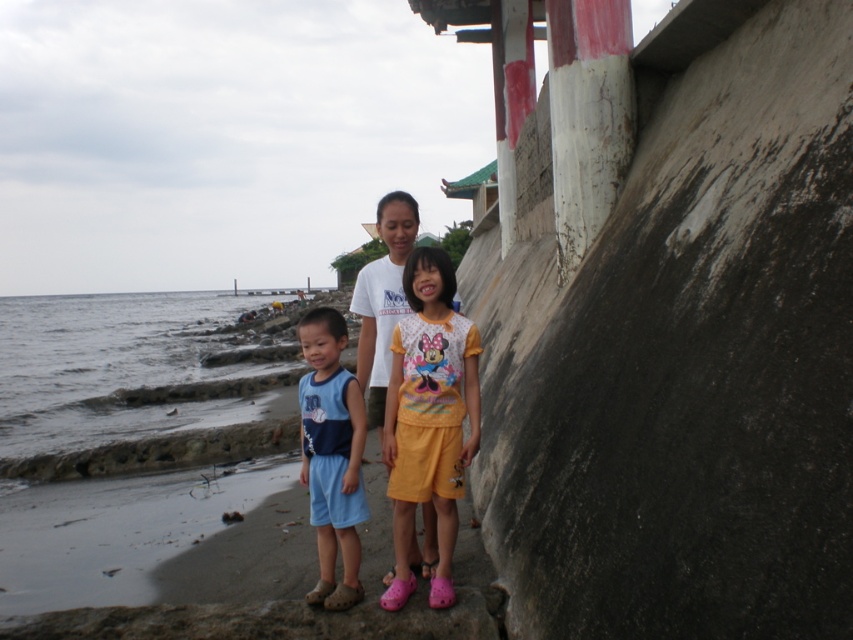
Is point (412, 387) more distant than point (347, 397)?

No, (412, 387) is closer to viewer.

Does yellow cotton shorts at center have a lesser width compared to blue fabric shorts at center?

No, yellow cotton shorts at center is not thinner than blue fabric shorts at center.

Who is more distant from viewer, (393, 378) or (323, 340)?

The point (393, 378) is more distant.

At what (x,y) coordinates should I click in order to perform the action: click on yellow cotton shorts at center. Please return your answer as a coordinate pair (x, y). The width and height of the screenshot is (853, 640). Looking at the image, I should click on (428, 417).